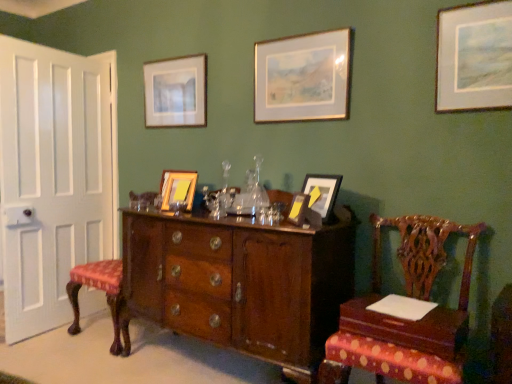
At what (x,y) coordinates should I click in order to perform the action: click on space that is in front of wooden chair with upholstered seat at left, the 1th chair when ordered from left to right. Please return your answer as a coordinate pair (x, y). This screenshot has width=512, height=384. Looking at the image, I should click on (78, 364).